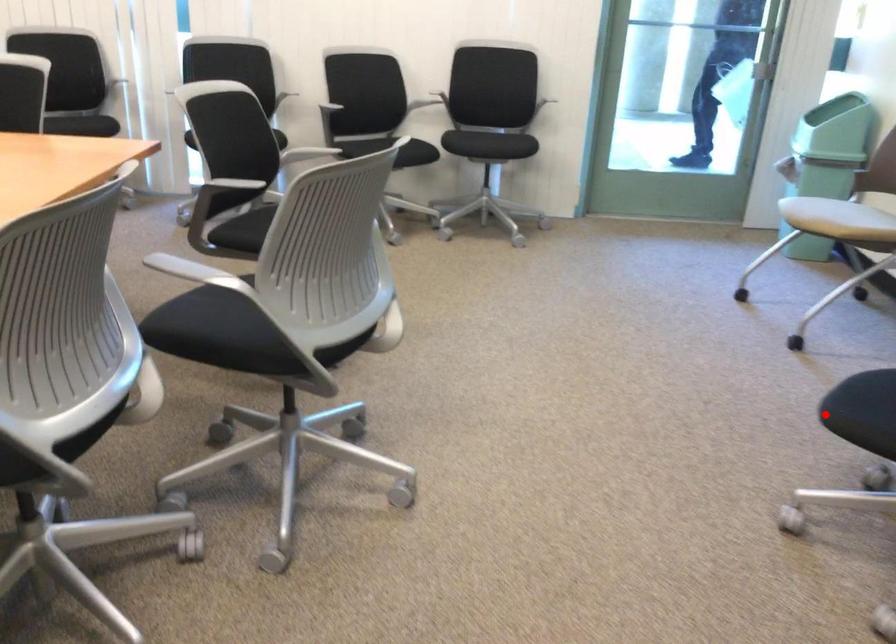
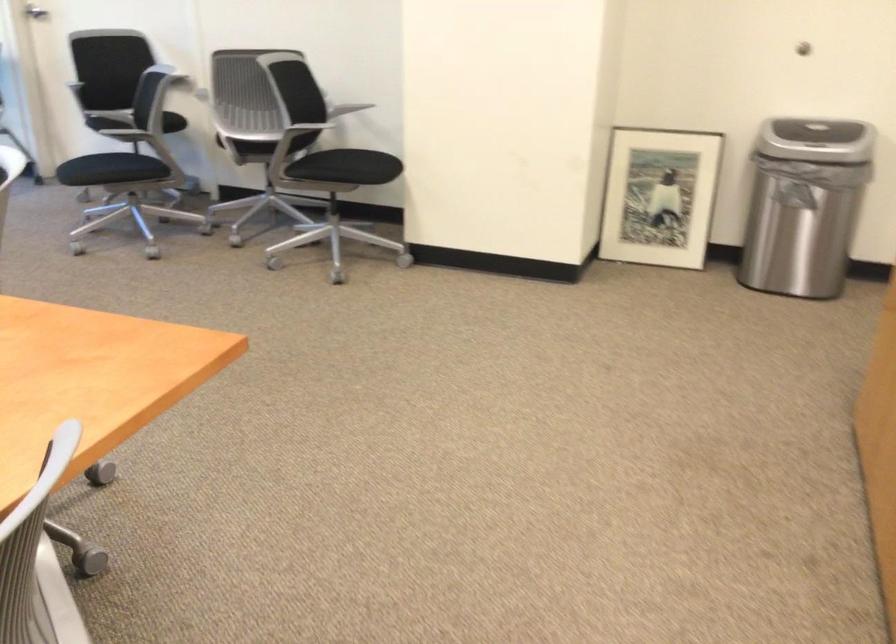
The point at the highlighted location is marked in the first image. Where is the corresponding point in the second image?

(112, 171)